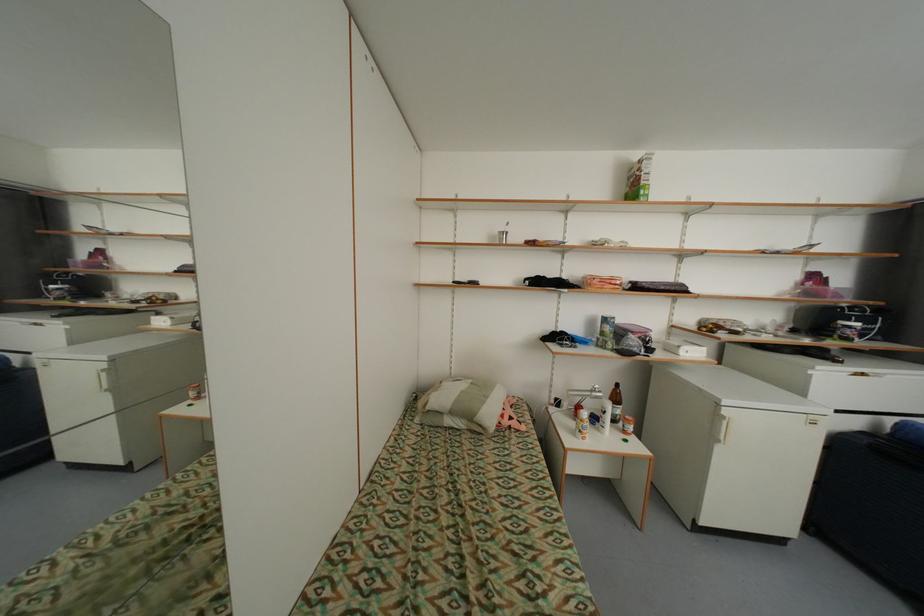
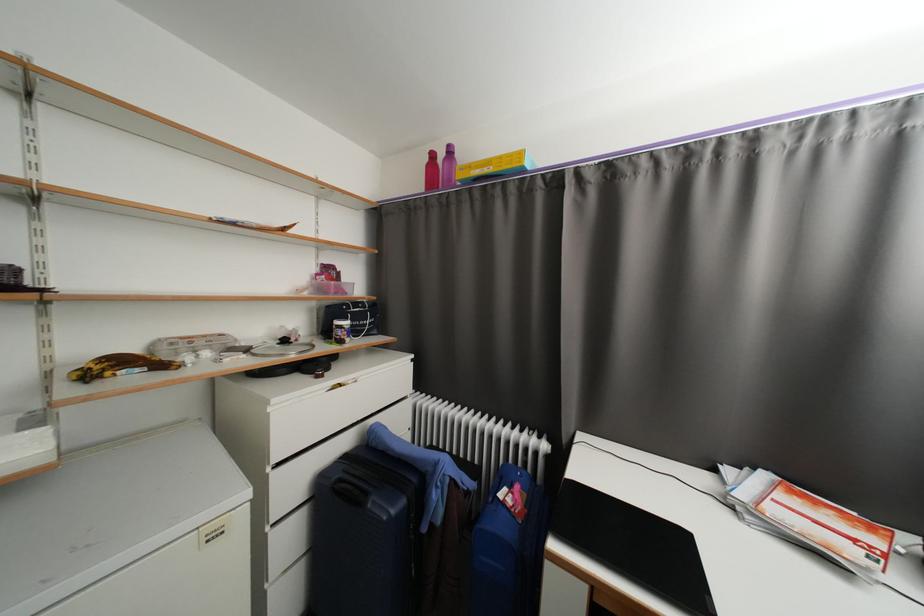
Where in the second image is the point corresponding to [857,333] from the first image?

(346, 334)